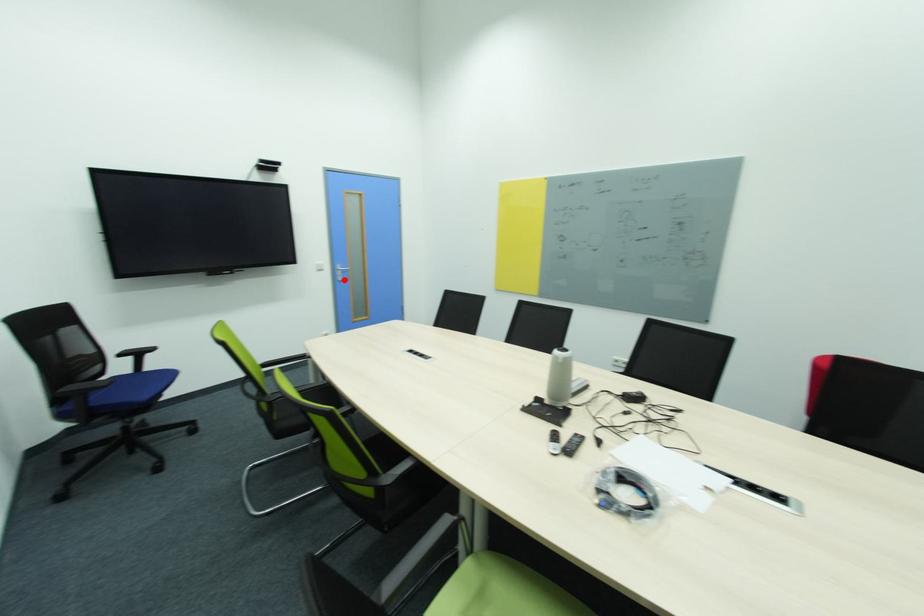
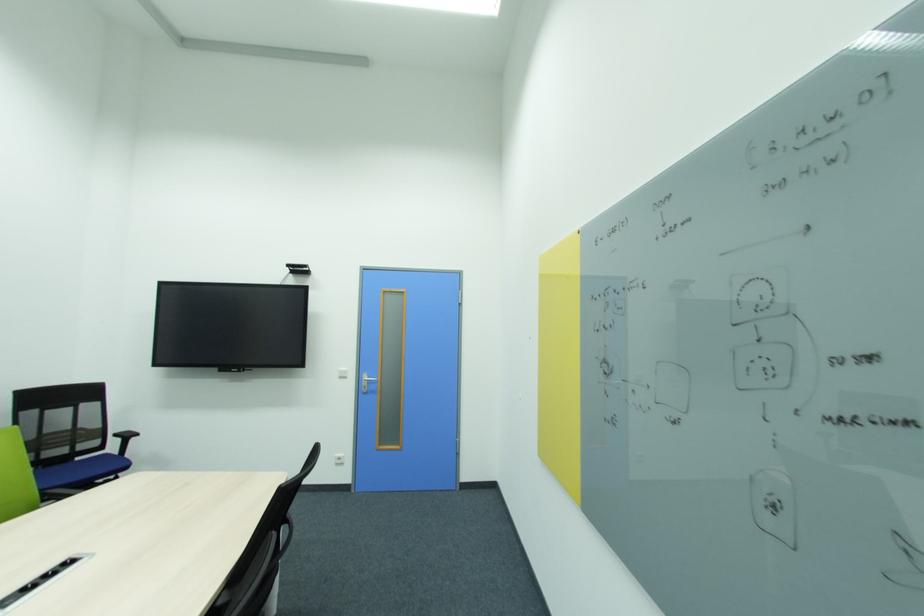
Question: I am providing you with two images of the same scene from different viewpoints. A red point is shown in image1. For the corresponding object point in image2, is it positioned nearer or farther from the camera?

Choices:
 (A) Nearer
 (B) Farther

Answer: (B)